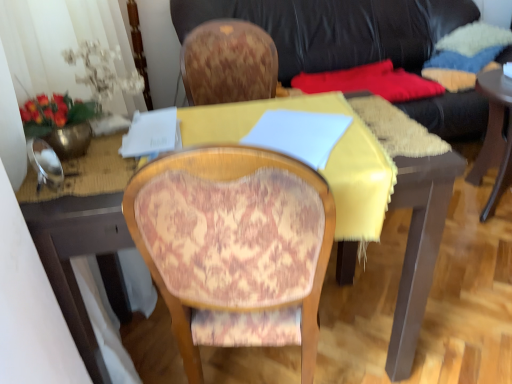
The image size is (512, 384). In order to click on black leather couch at upper center in this screenshot , I will do `click(337, 29)`.

Find the location of a particular element. Image resolution: width=512 pixels, height=384 pixels. patterned fabric chair at center is located at coordinates (228, 180).

From a real-world perspective, is yellow fabric-covered desk at center positioned above or below black leather couch at upper center?

From a real-world perspective, yellow fabric-covered desk at center is physically below black leather couch at upper center.

Considering the sizes of yellow fabric-covered desk at center and black leather couch at upper center in the image, is yellow fabric-covered desk at center taller or shorter than black leather couch at upper center?

In the image, yellow fabric-covered desk at center appears to be shorter than black leather couch at upper center.

Where is `desk in front of the black leather couch at upper center`? The image size is (512, 384). desk in front of the black leather couch at upper center is located at coordinates (419, 246).

Does yellow fabric-covered desk at center have a greater height compared to patterned fabric chair at center?

Incorrect, the height of yellow fabric-covered desk at center is not larger of that of patterned fabric chair at center.

Which is correct: yellow fabric-covered desk at center is inside patterned fabric chair at center, or outside of it?

yellow fabric-covered desk at center is inside patterned fabric chair at center.

Does yellow fabric-covered desk at center have a greater width compared to patterned fabric chair at center?

Correct, the width of yellow fabric-covered desk at center exceeds that of patterned fabric chair at center.

From the picture: Based on their sizes in the image, would you say yellow fabric-covered desk at center is bigger or smaller than patterned fabric chair at center?

yellow fabric-covered desk at center is bigger than patterned fabric chair at center.

Based on the photo, are patterned fabric chair at center and black leather couch at upper center beside each other?

No, patterned fabric chair at center is not touching black leather couch at upper center.

Considering the sizes of patterned fabric chair at center and black leather couch at upper center in the image, is patterned fabric chair at center bigger or smaller than black leather couch at upper center?

Clearly, patterned fabric chair at center is smaller in size than black leather couch at upper center.

Is patterned fabric chair at center not within black leather couch at upper center?

Indeed, patterned fabric chair at center is completely outside black leather couch at upper center.

Who is more distant, patterned fabric chair at center or black leather couch at upper center?

black leather couch at upper center.

From a real-world perspective, is patterned fabric chair at center below yellow fabric-covered desk at center?

→ No, from a real-world perspective, patterned fabric chair at center is not below yellow fabric-covered desk at center.

Which is in front, point (188, 167) or point (404, 288)?

Positioned in front is point (188, 167).

Is patterned fabric chair at center looking in the opposite direction of yellow fabric-covered desk at center?

Correct, patterned fabric chair at center is looking away from yellow fabric-covered desk at center.

From the image's perspective, is patterned fabric chair at center located above yellow fabric-covered desk at center?

No, from the image's perspective, patterned fabric chair at center is not on top of yellow fabric-covered desk at center.

In the scene shown: Which object is closer to the camera taking this photo, black leather couch at upper center or patterned fabric chair at center?

Positioned in front is patterned fabric chair at center.

From a real-world perspective, is black leather couch at upper center physically below patterned fabric chair at center?

No, from a real-world perspective, black leather couch at upper center is not beneath patterned fabric chair at center.

From the image's perspective, relative to patterned fabric chair at center, is black leather couch at upper center above or below?

black leather couch at upper center is situated higher than patterned fabric chair at center in the image.

Is black leather couch at upper center outside of patterned fabric chair at center?

Absolutely, black leather couch at upper center is external to patterned fabric chair at center.

Based on the photo, looking at their sizes, would you say black leather couch at upper center is wider or thinner than yellow fabric-covered desk at center?

Clearly, black leather couch at upper center has more width compared to yellow fabric-covered desk at center.

You are a GUI agent. You are given a task and a screenshot of the screen. Output one action in this format:
    pyautogui.click(x=<x>, y=<y>)
    Task: Click on the studio couch above the yellow fabric-covered desk at center (from a real-world perspective)
    
    Given the screenshot: What is the action you would take?
    pyautogui.click(x=337, y=29)

From a real-world perspective, is black leather couch at upper center positioned above or below yellow fabric-covered desk at center?

black leather couch at upper center is situated higher than yellow fabric-covered desk at center in the real world.

Would you say yellow fabric-covered desk at center is part of black leather couch at upper center's contents?

No.

You are a GUI agent. You are given a task and a screenshot of the screen. Output one action in this format:
    pyautogui.click(x=<x>, y=<y>)
    Task: Click on the studio couch positioned vertically above the yellow fabric-covered desk at center (from a real-world perspective)
    Image resolution: width=512 pixels, height=384 pixels.
    Given the screenshot: What is the action you would take?
    [337, 29]

Where is `desk above the patterned fabric chair at center (from the image's perspective)`? The height and width of the screenshot is (384, 512). desk above the patterned fabric chair at center (from the image's perspective) is located at coordinates (419, 246).

Which object lies further to the anchor point patterned fabric chair at center, yellow fabric-covered desk at center or black leather couch at upper center?

Based on the image, black leather couch at upper center appears to be further to patterned fabric chair at center.

Based on their spatial positions, is patterned fabric chair at center or yellow fabric-covered desk at center further from black leather couch at upper center?

patterned fabric chair at center is positioned further to the anchor black leather couch at upper center.

From the image, which object appears to be nearer to patterned fabric chair at center, black leather couch at upper center or yellow fabric-covered desk at center?

Among the two, yellow fabric-covered desk at center is located nearer to patterned fabric chair at center.

From the image, which object appears to be nearer to black leather couch at upper center, yellow fabric-covered desk at center or patterned fabric chair at center?

The object closer to black leather couch at upper center is yellow fabric-covered desk at center.

When comparing their distances from yellow fabric-covered desk at center, does black leather couch at upper center or patterned fabric chair at center seem closer?

patterned fabric chair at center is closer to yellow fabric-covered desk at center.

Considering their positions, is patterned fabric chair at center positioned further to yellow fabric-covered desk at center than black leather couch at upper center?

Based on the image, black leather couch at upper center appears to be further to yellow fabric-covered desk at center.

This screenshot has height=384, width=512. In order to click on desk located between patterned fabric chair at center and black leather couch at upper center in the depth direction in this screenshot , I will do `click(419, 246)`.